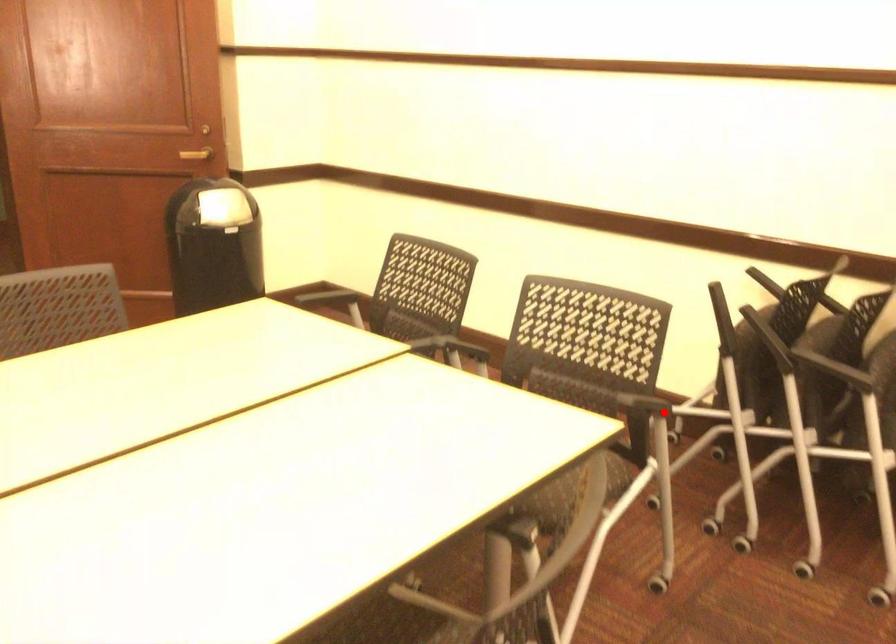
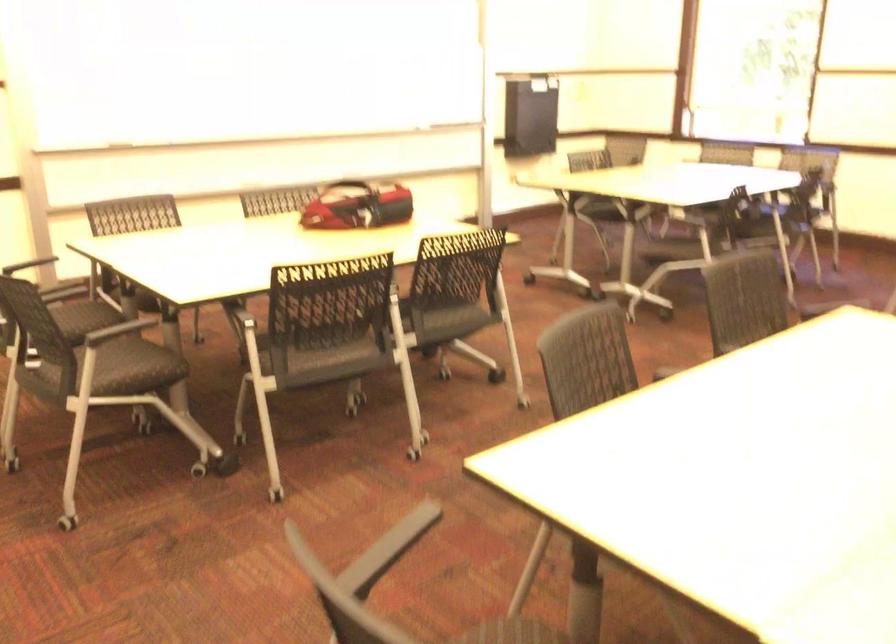
Find the pixel in the second image that matches the highlighted location in the first image.

(389, 549)